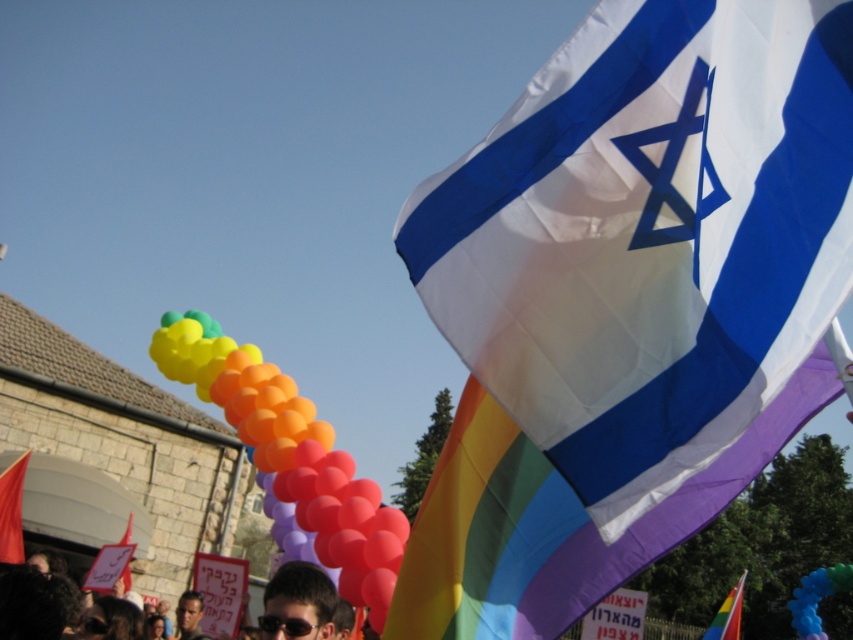
Who is taller, rainbow fabric flag at upper right or rainbow fabric flag at upper center?

Standing taller between the two is rainbow fabric flag at upper center.

Which is behind, point (503, 513) or point (709, 630)?

The point (709, 630) is more distant.

Where is `rainbow fabric flag at upper right`? rainbow fabric flag at upper right is located at coordinates (558, 518).

From the picture: Can you confirm if white silk flag at upper right is shorter than matte black sunglasses at center?

In fact, white silk flag at upper right may be taller than matte black sunglasses at center.

From the picture: Can you confirm if white silk flag at upper right is taller than matte black sunglasses at center?

Correct, white silk flag at upper right is much taller as matte black sunglasses at center.

Find the location of `white silk flag at upper right`. white silk flag at upper right is located at coordinates (648, 236).

Where is `white silk flag at upper right`? white silk flag at upper right is located at coordinates (648, 236).

Which is behind, point (718, 636) or point (292, 620)?

Point (718, 636)

Measure the distance between point (x=717, y=634) and camera.

Point (x=717, y=634) and camera are 16.76 meters apart from each other.

Locate an element on the screen. rainbow fabric flag at upper center is located at coordinates (728, 614).